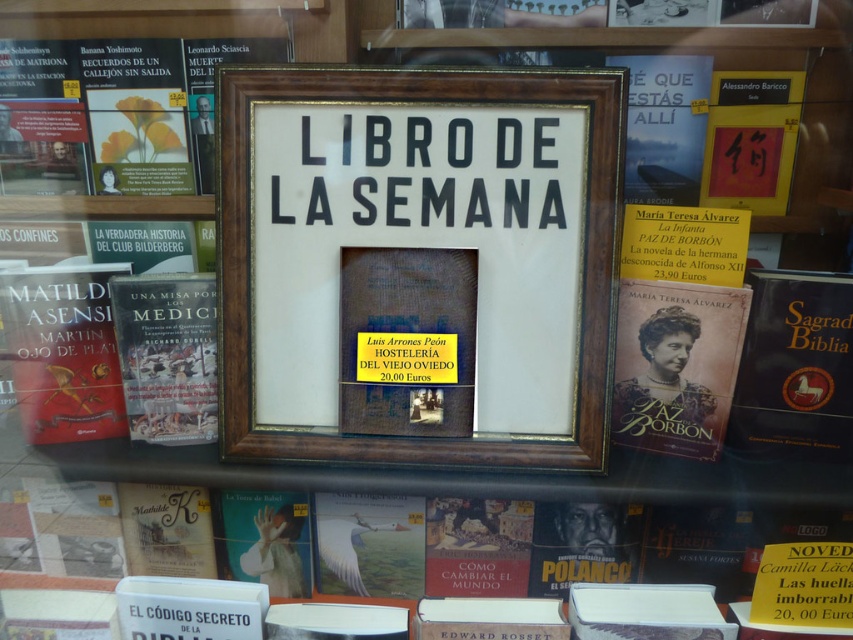
You are organizing a shelf in the bookstore and need to place the matte red book at left and the hardcover book at left. Which book should you place first if you want to arrange them from largest to smallest?

You should place the matte red book at left first since it is larger than the hardcover book at left.

You are organizing a shelf in the bookstore and need to place both the matte gold book at center and the matte red book at left. Which book requires a smaller space horizontally?

The matte gold book at center has a lesser width compared to the matte red book at left, so it requires a smaller horizontal space.